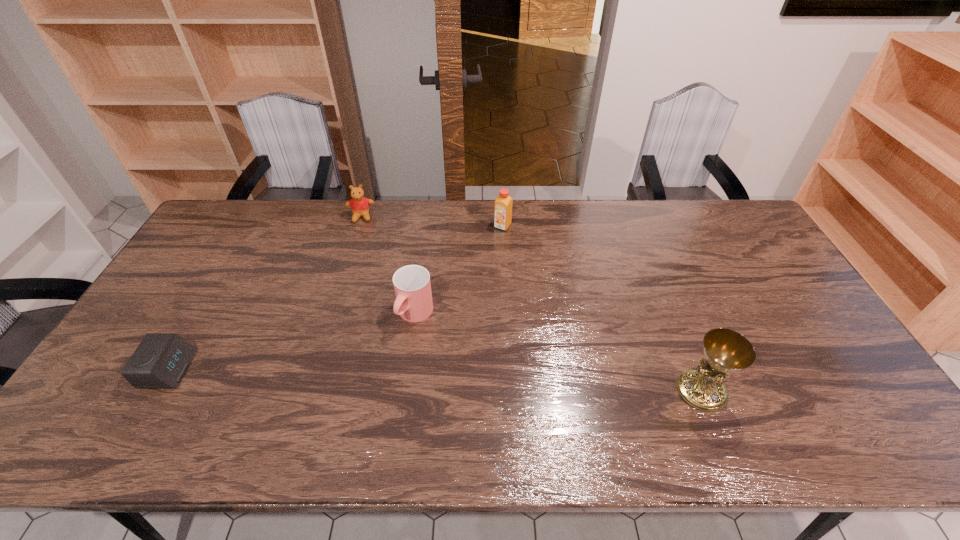
Locate an element on the screen. the shortest object is located at coordinates (160, 361).

This screenshot has width=960, height=540. Identify the location of the leftmost object. click(x=160, y=361).

You are a GUI agent. You are given a task and a screenshot of the screen. Output one action in this format:
    pyautogui.click(x=<x>, y=<y>)
    Task: Click on the rightmost object
    
    Given the screenshot: What is the action you would take?
    pyautogui.click(x=726, y=351)

Identify the location of chalice. (726, 351).

Identify the location of cup. (412, 286).

Locate an element on the screen. the third nearest object is located at coordinates [x=412, y=286].

Find the location of `the second object from left to right`. the second object from left to right is located at coordinates tap(360, 206).

I want to click on orange juice, so click(503, 206).

Locate an element on the screen. This screenshot has width=960, height=540. free location located on the front-facing side of the shortest object is located at coordinates (207, 369).

Where is `free space located 0.170m on the back of the rightmost object`? The width and height of the screenshot is (960, 540). free space located 0.170m on the back of the rightmost object is located at coordinates (673, 319).